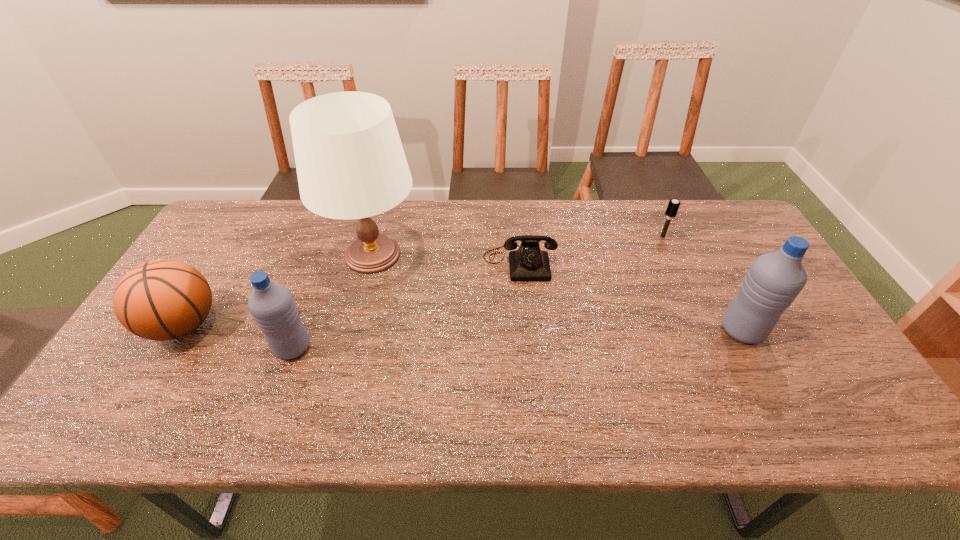
Identify the location of object that is at the left edge. The width and height of the screenshot is (960, 540). (160, 300).

Image resolution: width=960 pixels, height=540 pixels. I want to click on object situated at the right edge, so click(774, 280).

Identify the location of vacant region at the far edge of the desktop. (290, 230).

In the image, there is a desktop. At what (x,y) coordinates should I click in order to perform the action: click on vacant space at the near edge. Please return your answer as a coordinate pair (x, y). This screenshot has width=960, height=540. Looking at the image, I should click on (424, 383).

This screenshot has height=540, width=960. In the image, there is a desktop. Identify the location of vacant area at the left edge. (223, 254).

Image resolution: width=960 pixels, height=540 pixels. In the image, there is a desktop. Find the location of `free region at the right edge`. free region at the right edge is located at coordinates (799, 309).

In the image, there is a desktop. Identify the location of vacant space at the far right corner. The width and height of the screenshot is (960, 540). (744, 231).

At what (x,y) coordinates should I click in order to perform the action: click on free space between the hairbrush and the shortest object. Please return your answer as a coordinate pair (x, y). Looking at the image, I should click on (591, 249).

The image size is (960, 540). I want to click on free space that is in between the third object from right to left and the taller water bottle, so click(x=631, y=296).

Identify the location of free point between the third object from right to left and the second tallest object. The height and width of the screenshot is (540, 960). (631, 296).